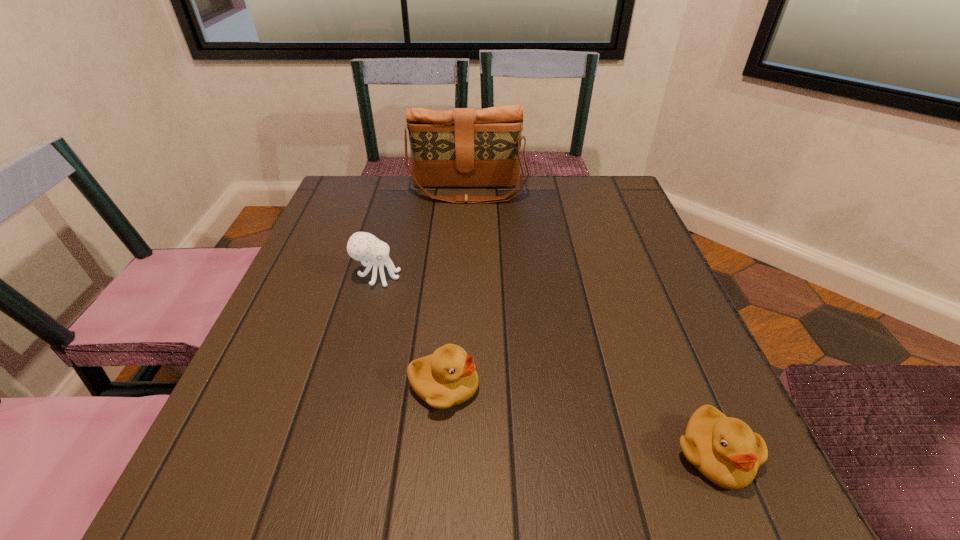
Where is `the farthest object`? The width and height of the screenshot is (960, 540). the farthest object is located at coordinates (464, 147).

Where is `the tallest object`? This screenshot has width=960, height=540. the tallest object is located at coordinates (464, 147).

I want to click on the second farthest object, so click(362, 246).

At what (x,y) coordinates should I click in order to perform the action: click on octopus. Please return your answer as a coordinate pair (x, y). The image size is (960, 540). Looking at the image, I should click on (362, 246).

Image resolution: width=960 pixels, height=540 pixels. Identify the location of the third farthest object. (446, 378).

Image resolution: width=960 pixels, height=540 pixels. What are the coordinates of `the farther duckling` in the screenshot? It's located at (446, 378).

The width and height of the screenshot is (960, 540). I want to click on the right duckling, so click(725, 450).

Locate an element on the screen. The width and height of the screenshot is (960, 540). the rightmost object is located at coordinates (725, 450).

Locate an element on the screen. This screenshot has height=540, width=960. vacant point located on the front-facing side of the shoulder bag is located at coordinates (466, 254).

The width and height of the screenshot is (960, 540). I want to click on vacant space located 0.310m on the front-facing side of the second tallest object, so click(546, 276).